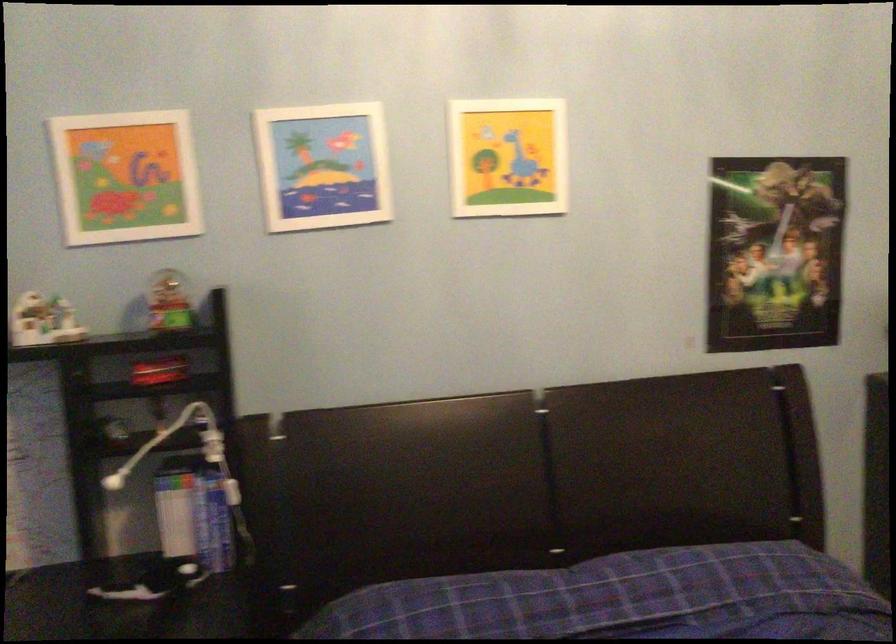
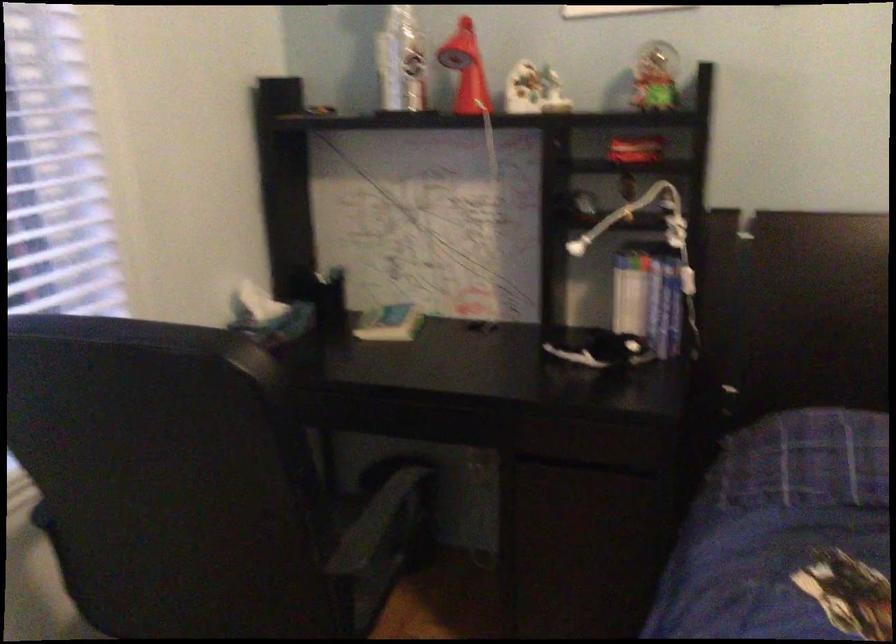
In the second image, find the point that corresponds to point 109,484 in the first image.

(576, 247)